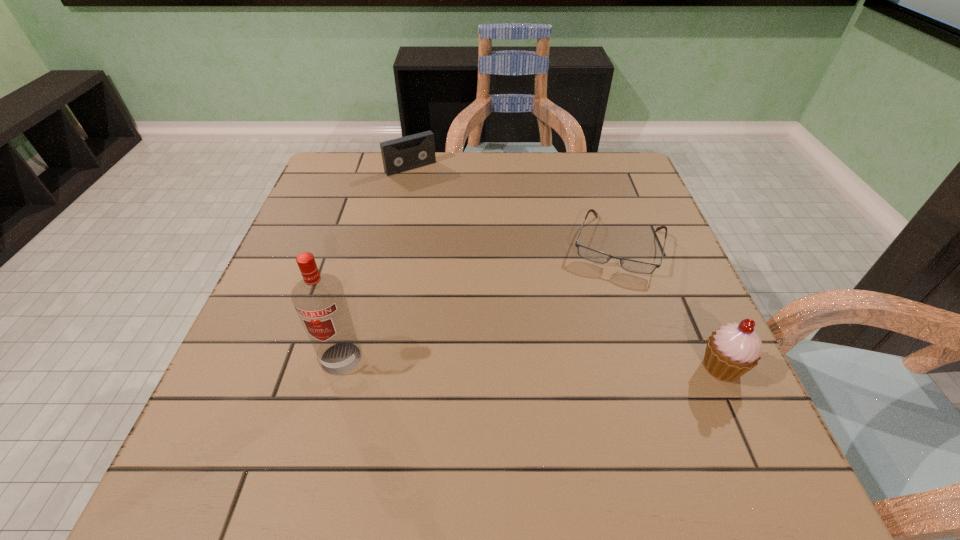
Image resolution: width=960 pixels, height=540 pixels. Find the location of `free space that is in between the vodka and the shortest object`. free space that is in between the vodka and the shortest object is located at coordinates (479, 301).

Image resolution: width=960 pixels, height=540 pixels. What are the coordinates of `empty space between the third shortest object and the farthest object` in the screenshot? It's located at (566, 267).

Find the location of a particular element. The height and width of the screenshot is (540, 960). free space between the farthest object and the second tallest object is located at coordinates (566, 267).

The width and height of the screenshot is (960, 540). What are the coordinates of `unoccupied position between the shortest object and the cupcake` in the screenshot? It's located at (669, 306).

This screenshot has height=540, width=960. Identify the location of empty space that is in between the cupcake and the tallest object. (532, 362).

The width and height of the screenshot is (960, 540). I want to click on free area in between the vodka and the cupcake, so click(532, 362).

Select which object is the second closest to the farthest object. Please provide its 2D coordinates. Your answer should be formatted as a tuple, i.e. [(x, y)], where the tuple contains the x and y coordinates of a point satisfying the conditions above.

[(319, 299)]

Identify the location of object that is the closest to the videotape. The height and width of the screenshot is (540, 960). (590, 254).

Image resolution: width=960 pixels, height=540 pixels. What are the coordinates of `free space that satisfies the following two spatial constraints: 1. on the front side of the cupcake; 2. on the left side of the second farthest object` in the screenshot? It's located at (658, 367).

The height and width of the screenshot is (540, 960). I want to click on vacant space that satisfies the following two spatial constraints: 1. on the front label of the vodka; 2. on the right side of the cupcake, so click(x=339, y=367).